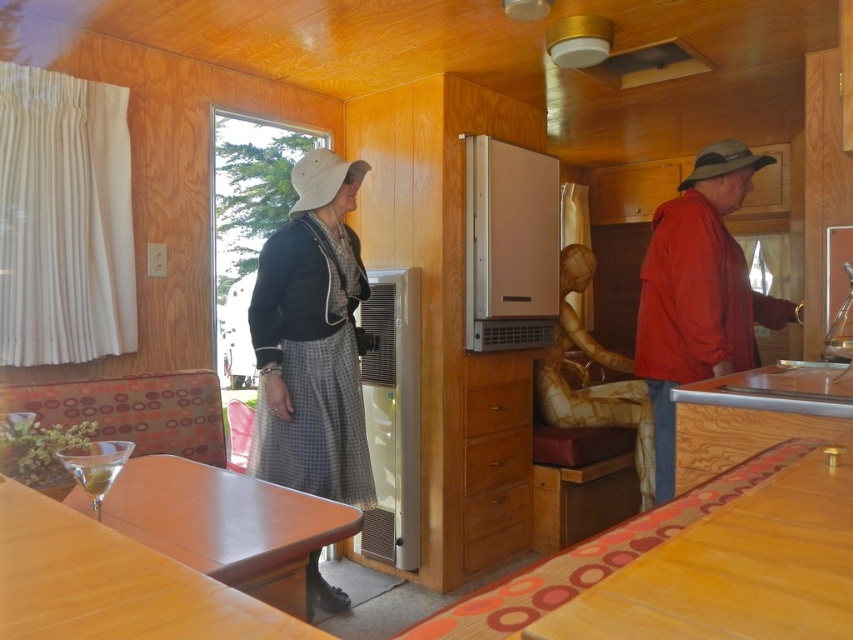
Does clear glass martini glass at lower left appear over green olive at lower left?

No.

Which of these two, clear glass martini glass at lower left or green olive at lower left, stands taller?

clear glass martini glass at lower left is taller.

Is point (59, 458) positioned behind point (90, 486)?

Yes, point (59, 458) is farther from viewer.

Where is `clear glass martini glass at lower left`? This screenshot has height=640, width=853. clear glass martini glass at lower left is located at coordinates (96, 465).

Can you confirm if black woolen jacket at center is taller than clear glass martini glass at lower left?

Yes, black woolen jacket at center is taller than clear glass martini glass at lower left.

Who is more forward, (x=258, y=413) or (x=102, y=474)?

Point (x=102, y=474) is in front.

What do you see at coordinates (312, 340) in the screenshot? The width and height of the screenshot is (853, 640). I see `black woolen jacket at center` at bounding box center [312, 340].

Locate an element on the screen. The width and height of the screenshot is (853, 640). black woolen jacket at center is located at coordinates (312, 340).

Is black woolen jacket at center below metallic gold exhaust hood at upper center?

Correct, black woolen jacket at center is located below metallic gold exhaust hood at upper center.

Does black woolen jacket at center appear on the right side of metallic gold exhaust hood at upper center?

In fact, black woolen jacket at center is to the left of metallic gold exhaust hood at upper center.

Measure the distance between black woolen jacket at center and camera.

black woolen jacket at center and camera are 7.68 feet apart from each other.

I want to click on black woolen jacket at center, so click(312, 340).